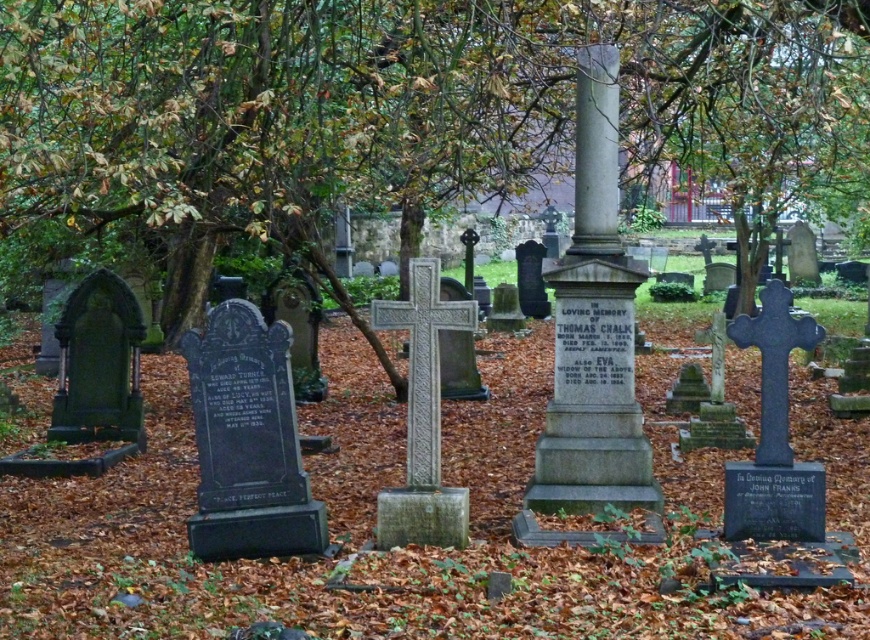
Question: Which point appears farthest from the camera in this image?

Choices:
 (A) (28, 97)
 (B) (574, 266)

Answer: (B)

Question: Observing the image, what is the correct spatial positioning of green leafy tree at center in reference to gray stone column at center?

Choices:
 (A) right
 (B) left

Answer: (B)

Question: Can you confirm if green leafy tree at center is positioned to the left of gray stone column at center?

Choices:
 (A) yes
 (B) no

Answer: (A)

Question: Which point is closer to the camera taking this photo?

Choices:
 (A) (686, 161)
 (B) (572, 465)

Answer: (B)

Question: Can you confirm if green leafy tree at center is smaller than gray stone column at center?

Choices:
 (A) yes
 (B) no

Answer: (B)